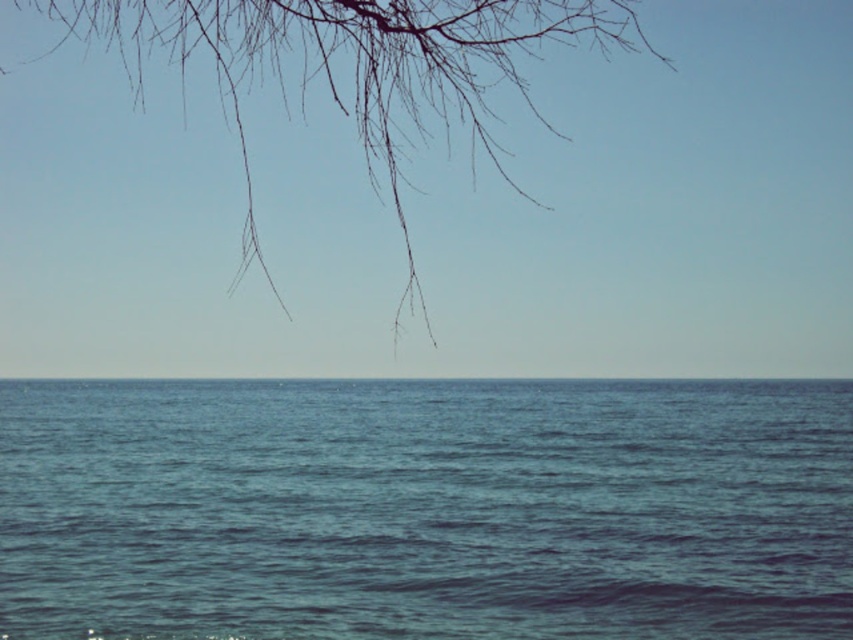
Locate an element on the screen. This screenshot has width=853, height=640. blue liquid water at center is located at coordinates (425, 508).

Between blue liquid water at center and bare branches at upper left, which one is positioned lower?

Positioned lower is blue liquid water at center.

Where is `blue liquid water at center`? blue liquid water at center is located at coordinates (425, 508).